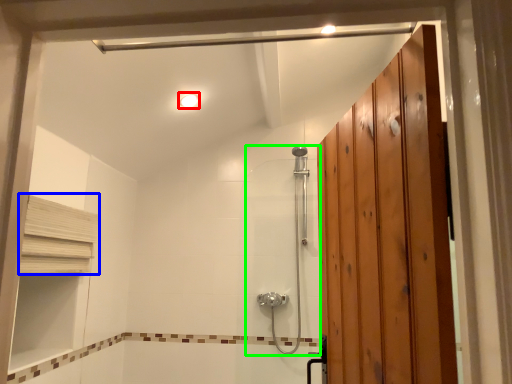
Question: Which object is the closest to the light fixture (highlighted by a red box)? Choose among these: shelf (highlighted by a blue box) or shower door (highlighted by a green box).

Choices:
 (A) shelf
 (B) shower door

Answer: (A)